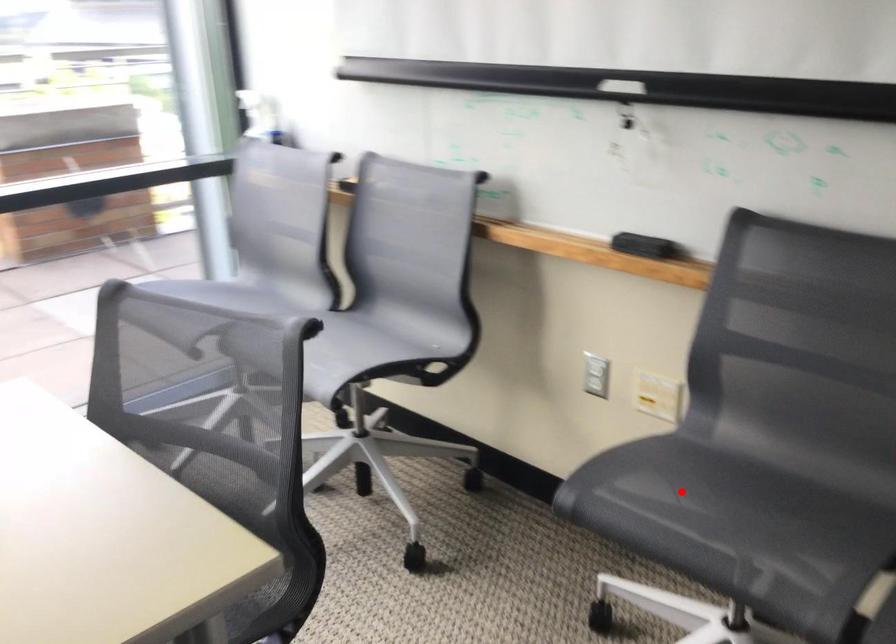
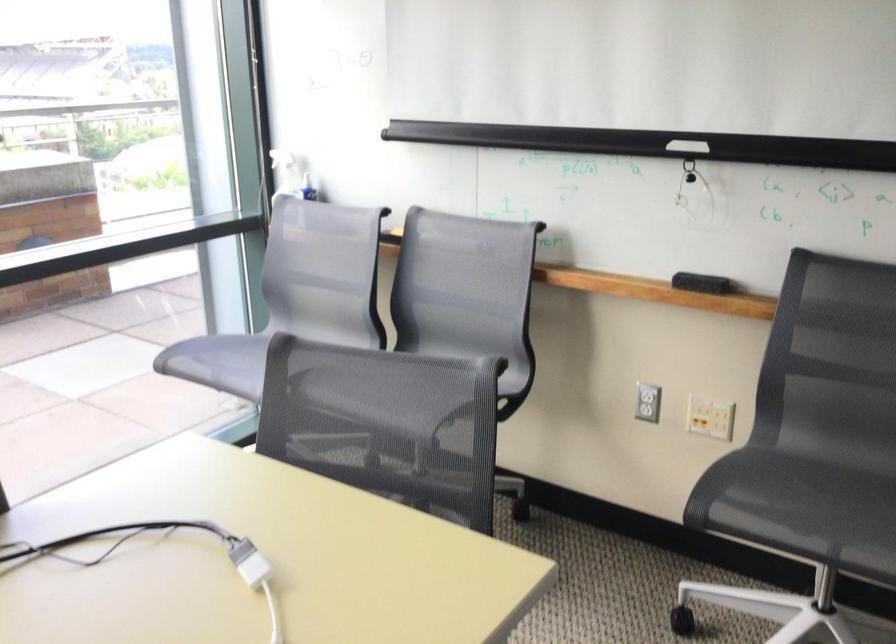
Locate, in the second image, the point that corresponds to the highlighted location in the first image.

(782, 494)